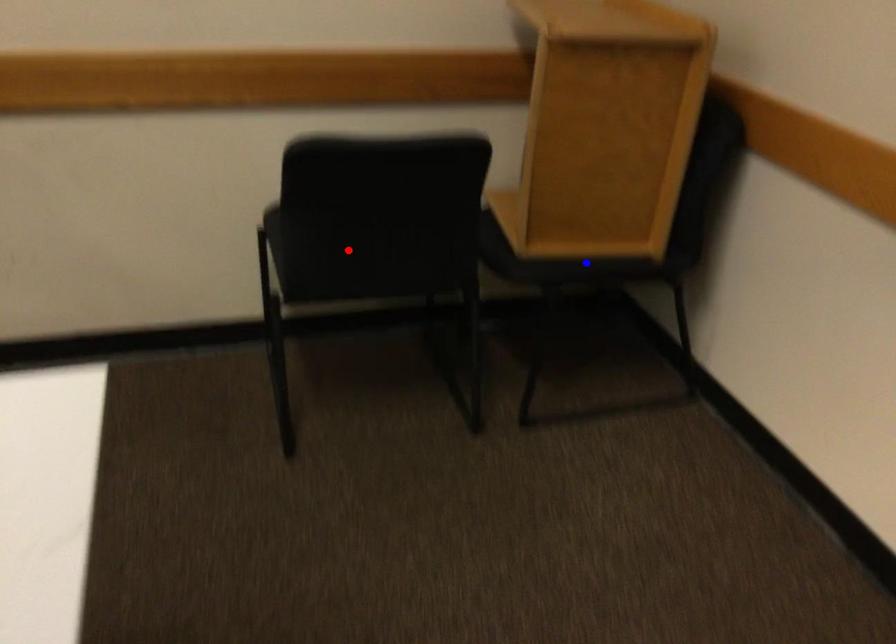
Question: In the image, two points are highlighted. Which point is nearer to the camera? Reply with the corresponding letter.

Choices:
 (A) blue point
 (B) red point

Answer: (B)